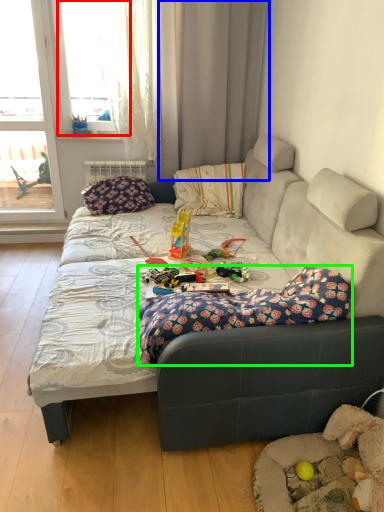
Question: Which object is positioned farthest from window (highlighted by a red box)? Select from curtain (highlighted by a blue box) and blanket (highlighted by a green box).

Choices:
 (A) curtain
 (B) blanket

Answer: (B)